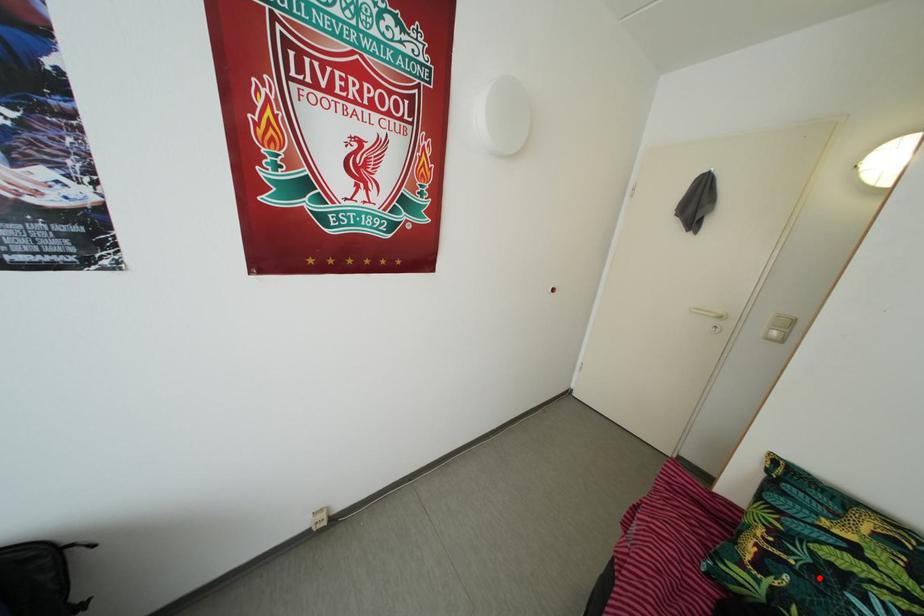
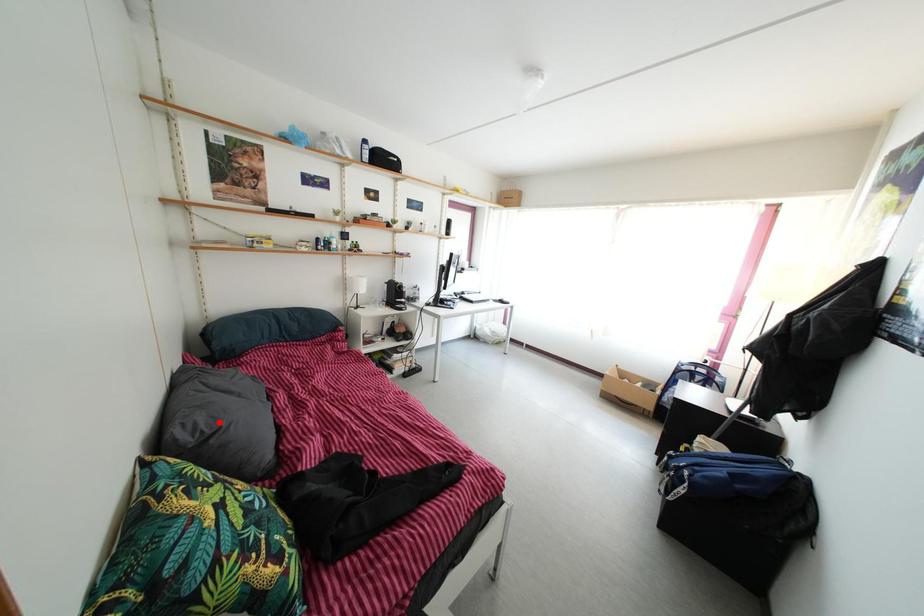
I am providing you with two images of the same scene from different viewpoints. A red point is marked on the first image and another point is marked on the second image. Does the point marked in image1 correspond to the same location as the one in image2?

No